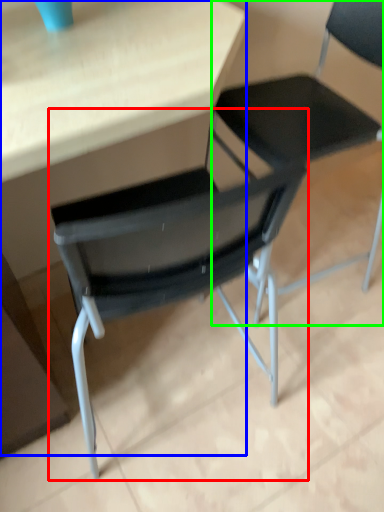
Question: Estimate the real-world distances between objects in this image. Which object is farther from chair (highlighted by a red box), table (highlighted by a blue box) or chair (highlighted by a green box)?

Choices:
 (A) table
 (B) chair

Answer: (B)